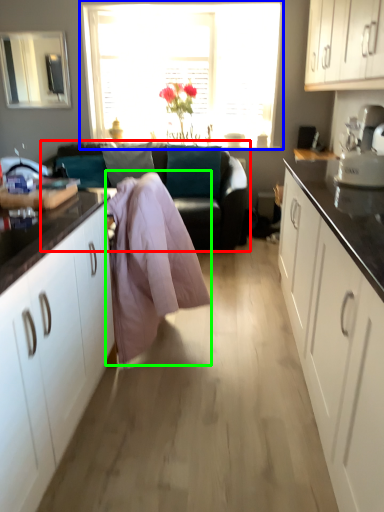
Question: Considering the real-world distances, which object is closest to studio couch (highlighted by a red box)? window (highlighted by a blue box) or blanket (highlighted by a green box).

Choices:
 (A) window
 (B) blanket

Answer: (A)